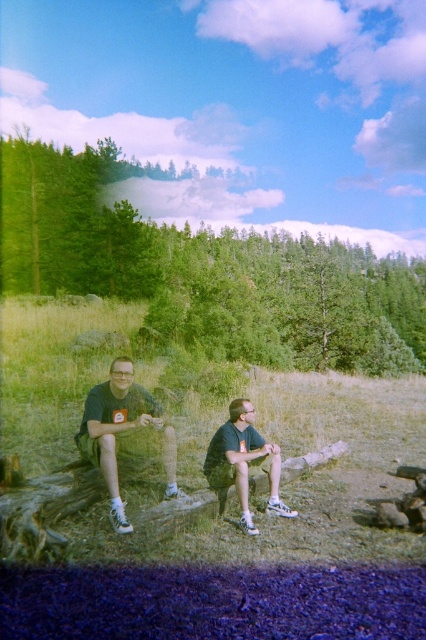
Question: Does matte black t-shirt at left appear under dark green fabric shirt at center?

Choices:
 (A) yes
 (B) no

Answer: (B)

Question: Estimate the real-world distances between objects in this image. Which object is closer to the matte black t-shirt at left?

Choices:
 (A) green leafy tree at upper left
 (B) dark green fabric shorts at center
 (C) dark green fabric shirt at center

Answer: (B)

Question: Which object appears farthest from the camera in this image?

Choices:
 (A) dark green fabric shirt at center
 (B) dark green fabric shorts at center
 (C) green leafy tree at upper left

Answer: (C)

Question: Which of these objects is positioned closest to the matte black t-shirt at left?

Choices:
 (A) dark green fabric shirt at center
 (B) dark green fabric shorts at center

Answer: (B)

Question: Where is green leafy tree at upper left located in relation to dark green fabric shirt at center in the image?

Choices:
 (A) right
 (B) left

Answer: (A)

Question: From the image, what is the correct spatial relationship of green leafy tree at upper left in relation to dark green fabric shirt at center?

Choices:
 (A) below
 (B) above

Answer: (B)